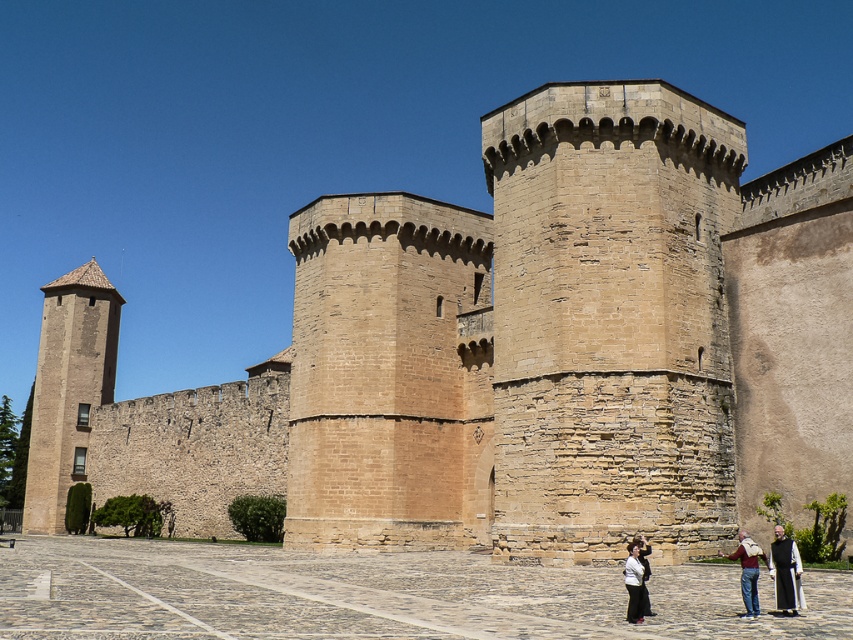
Can you confirm if brown stone tower at left is positioned to the right of white cotton shirt at lower center?

In fact, brown stone tower at left is to the left of white cotton shirt at lower center.

Who is shorter, brown stone tower at left or white cotton shirt at lower center?

white cotton shirt at lower center is shorter.

Which is behind, point (25, 509) or point (637, 596)?

The point (25, 509) is more distant.

Find the location of a particular element. This screenshot has width=853, height=640. brown stone tower at left is located at coordinates [x=68, y=388].

Between denim jeans at lower right and white cotton shirt at lower center, which one is positioned lower?

Positioned lower is denim jeans at lower right.

Which of these two, denim jeans at lower right or white cotton shirt at lower center, stands taller?

denim jeans at lower right

Between point (732, 556) and point (641, 566), which one is positioned in front?

Point (641, 566)

At what (x,y) coordinates should I click in order to perform the action: click on denim jeans at lower right. Please return your answer as a coordinate pair (x, y). This screenshot has width=853, height=640. Looking at the image, I should click on (747, 570).

Who is positioned more to the right, brown stone tower at left or denim jeans at lower right?

denim jeans at lower right is more to the right.

Can you confirm if brown stone tower at left is positioned to the right of denim jeans at lower right?

In fact, brown stone tower at left is to the left of denim jeans at lower right.

The width and height of the screenshot is (853, 640). Identify the location of brown stone tower at left. (68, 388).

Where is `brown stone tower at left`? The height and width of the screenshot is (640, 853). brown stone tower at left is located at coordinates (68, 388).